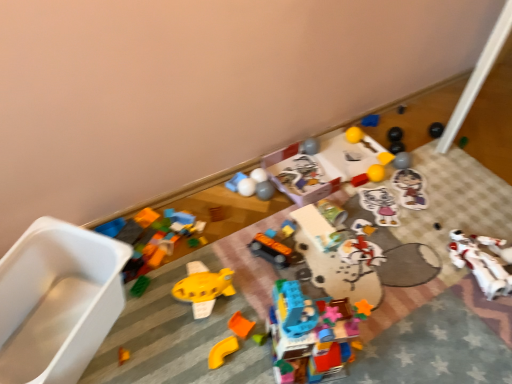
This screenshot has width=512, height=384. Identify the location of vacant location behind matte white plush cat at center, marked as the fifth toy in a right-to-left arrangement. (381, 179).